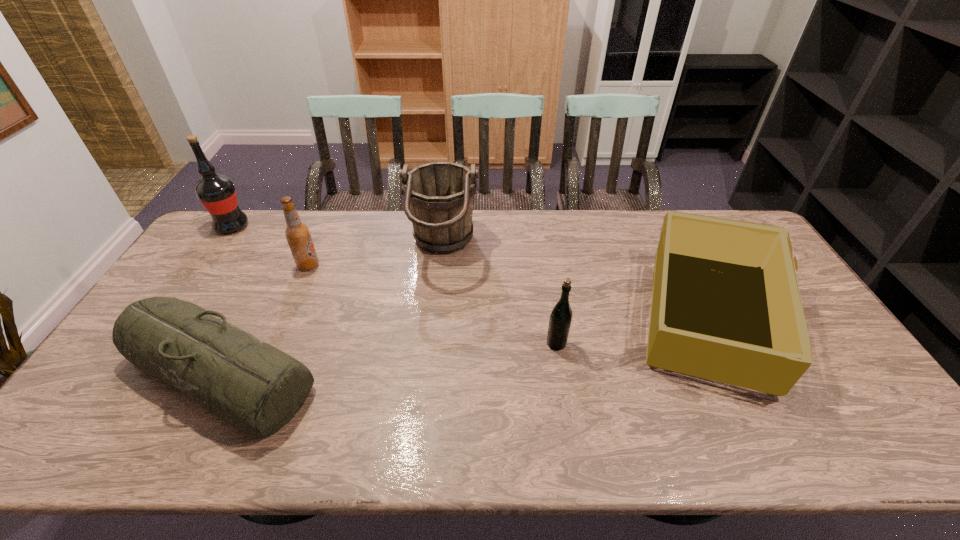
Image resolution: width=960 pixels, height=540 pixels. I want to click on object present at the far left corner, so click(217, 193).

Locate an element on the screen. object located at the near left corner is located at coordinates (256, 388).

Find the location of a particular element. vacant space at the far edge is located at coordinates (316, 226).

Locate an element on the screen. The image size is (960, 540). vacant position at the near edge of the desktop is located at coordinates (615, 426).

Identify the location of free space at the right edge. This screenshot has height=540, width=960. (813, 403).

Where is `vacant space at the near right corner`? The height and width of the screenshot is (540, 960). vacant space at the near right corner is located at coordinates (842, 444).

Where is `free spot between the wine bottle and the rightmost object`? free spot between the wine bottle and the rightmost object is located at coordinates (469, 273).

Find the location of `vacant space that is in between the second shortest object and the shortest object`. vacant space that is in between the second shortest object and the shortest object is located at coordinates (464, 346).

At what (x,y) coordinates should I click in order to perform the action: click on free space between the farther beer bottle and the duffel bag. Please return your answer as a coordinate pair (x, y). Looking at the image, I should click on (264, 320).

In order to click on vacant point located between the box and the third object from right to left in this screenshot , I will do `click(574, 284)`.